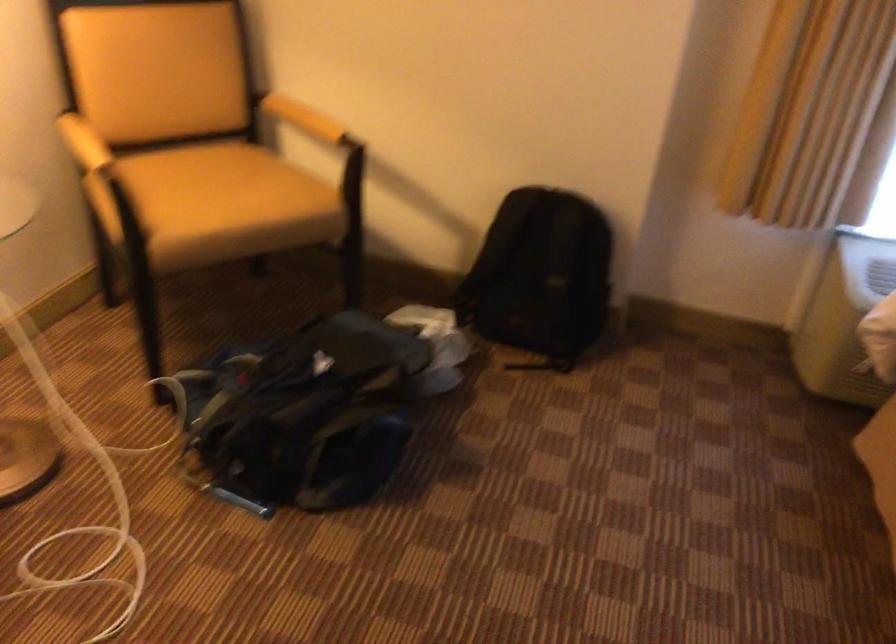
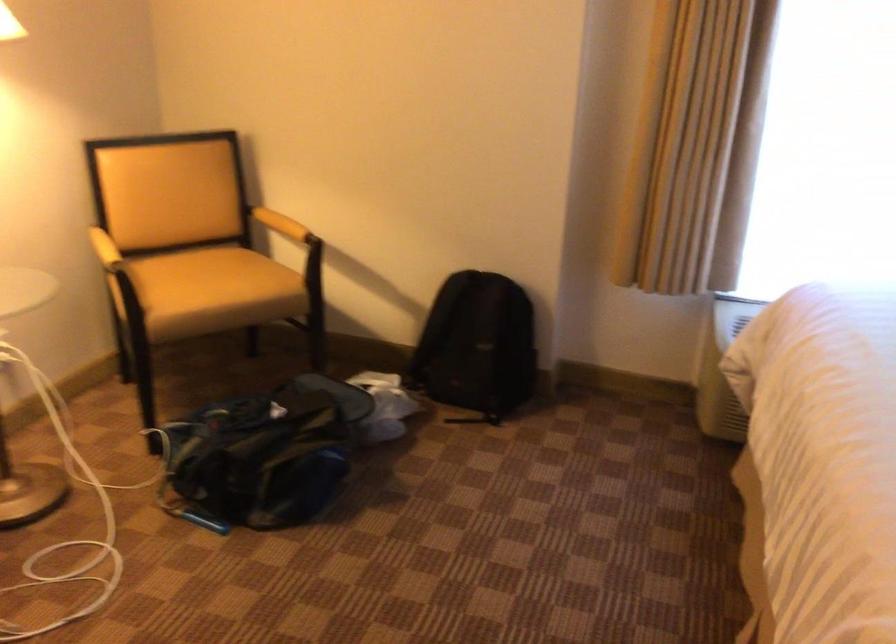
Which direction would the cameraman need to move to produce the second image?

The cameraman walked toward right, backward.